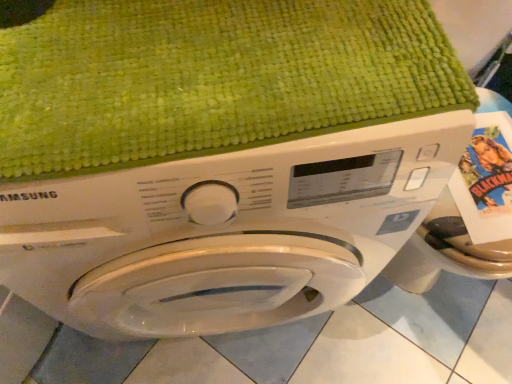
This screenshot has height=384, width=512. I want to click on free location above white glossy washing machine at center (from a real-world perspective), so pyautogui.click(x=199, y=75).